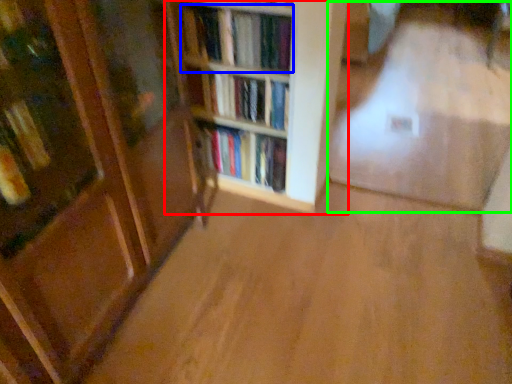
Question: Which is nearer to the shelf (highlighted by a red box)? book (highlighted by a blue box) or corridor (highlighted by a green box).

Choices:
 (A) book
 (B) corridor

Answer: (A)